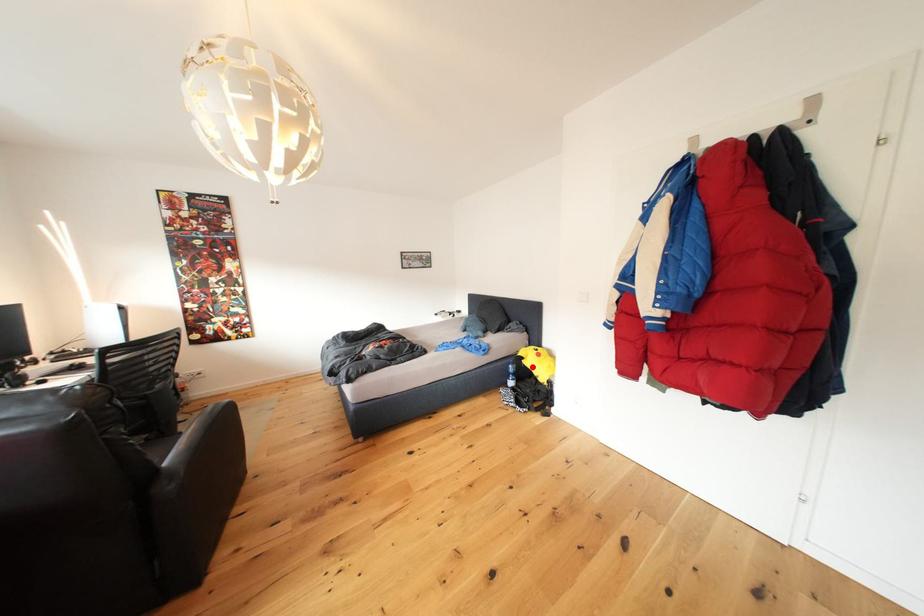
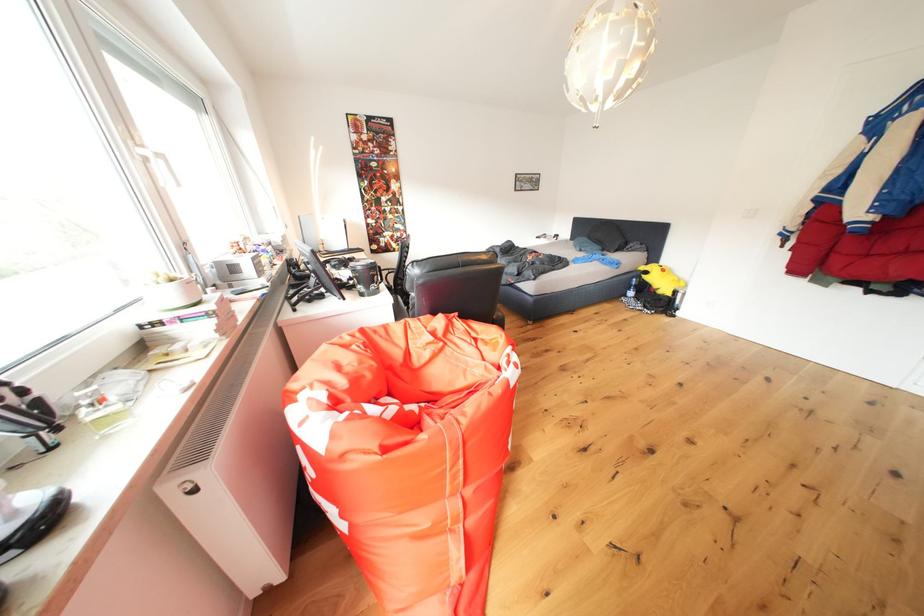
Question: A red point is marked in image1. In image2, is the corresponding 3D point closer to the camera or farther? Reply with the corresponding letter.

Choices:
 (A) The corresponding 3D point is closer.
 (B) The corresponding 3D point is farther.

Answer: (A)